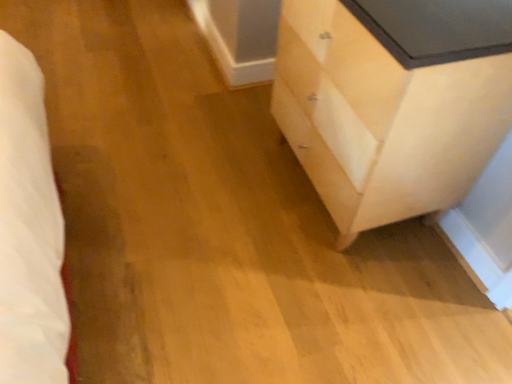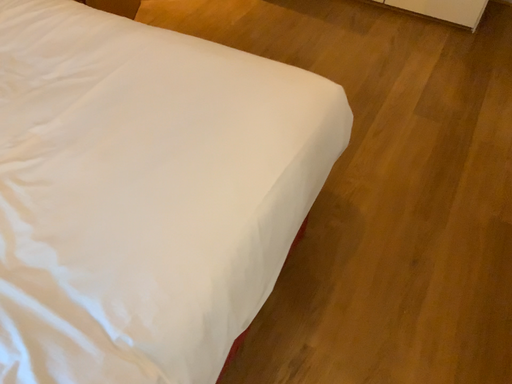
Question: How did the camera likely rotate when shooting the video?

Choices:
 (A) rotated right
 (B) rotated left

Answer: (B)